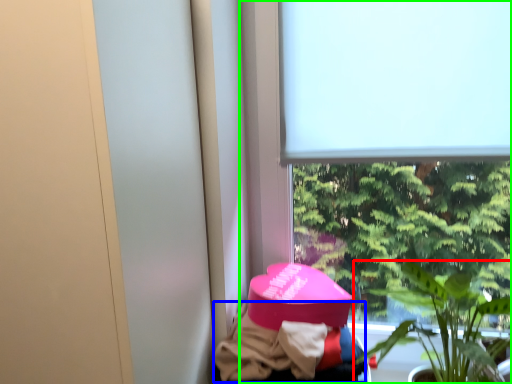
Question: Considering the real-world distances, which object is closest to houseplant (highlighted by a red box)? clothing (highlighted by a blue box) or window (highlighted by a green box).

Choices:
 (A) clothing
 (B) window

Answer: (B)